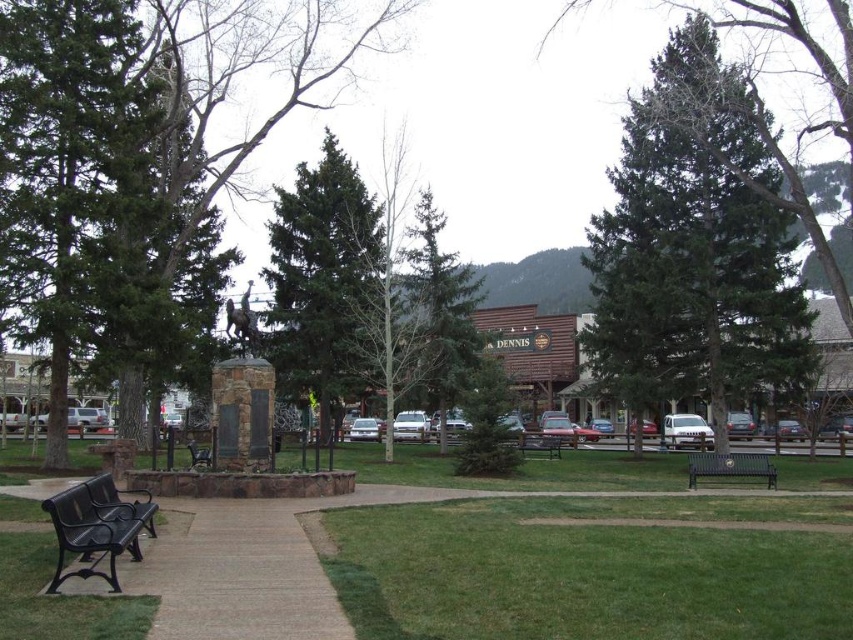
You are planning to place a new bench in the park so that it is closer to the monument than the existing wooden park bench at center. The monument is at the center of the park. Where should you position the new bench relative to the green coniferous tree at center?

The green coniferous tree at center is larger than the wooden park bench at center. To place the new bench closer to the monument than the existing bench, position it between the green coniferous tree at center and the monument, ensuring it is nearer to the monument than the current bench.